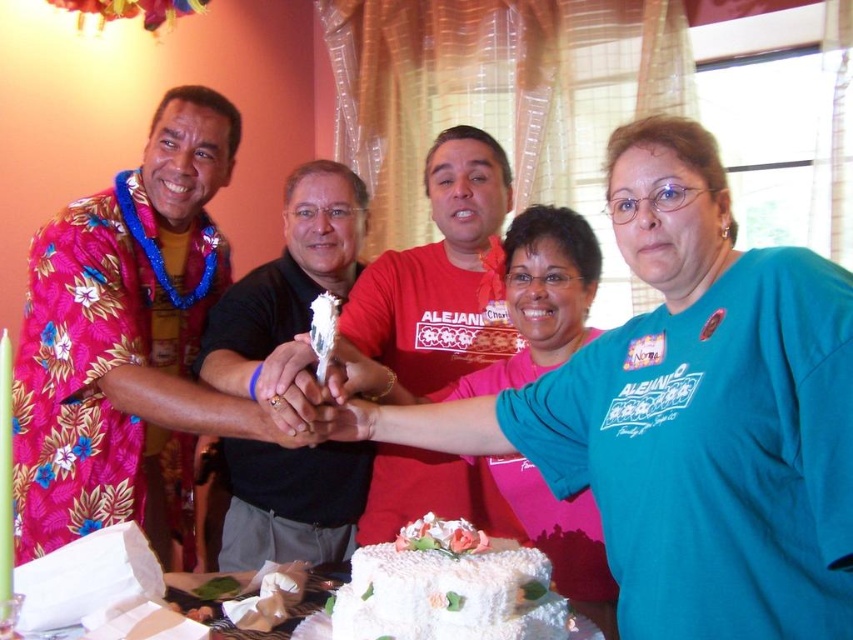
You are a photographer trying to capture the group of people at the gathering. You notice a floral print shirt at left located at point (x=126, y=344). Where should you position your camera to ensure the floral print shirt at left is centered in the frame?

To center the floral print shirt at left in the frame, position the camera directly facing the point (x=126, y=344) where the floral print shirt at left is located.

You are planning to take a photo of the white frosted cake at center and want to include the floral print shirt at left in the frame. Based on their positions, can you position yourself so that both are visible in the same shot?

Yes, since the floral print shirt at left is to the left of the white frosted cake at center, positioning yourself to the right side of the cake would allow both objects to be captured in the same frame.

You are organizing a group photo and need to arrange the floral print shirt at left and the matte red shirt at center side by side. Based on their sizes, which one should be placed on the left to ensure they fit within the frame without overlapping?

The floral print shirt at left should be placed on the left since it is wider than the matte red shirt at center, allowing both to fit side by side without overlapping.